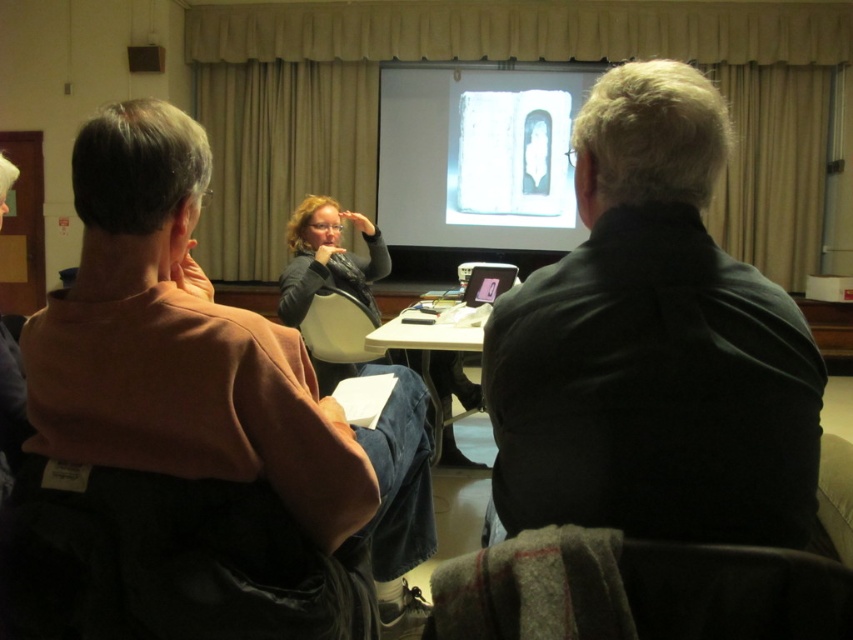
You are a cleaning robot with a width of 0.8 meters. You are positioned behind the brown cotton shirt at left and need to move to the white plastic table at center. Is there enough space between them for you to pass through?

→ The distance between the brown cotton shirt at left and the white plastic table at center is 1.40 meters. Since the robot is 0.8 meters wide, there is sufficient space to pass through as 1.40 meters is greater than 0.8 meters.

You are a person sitting in the back row of the conference room. You want to reach the white plastic table at center to grab a pen. The dark gray shirt at center is blocking your path. Can you walk around them to reach the table?

The dark gray shirt at center and white plastic table at center are 1.83 meters apart, so you can walk around the dark gray shirt at center to reach the white plastic table at center since the distance allows enough space to maneuver.